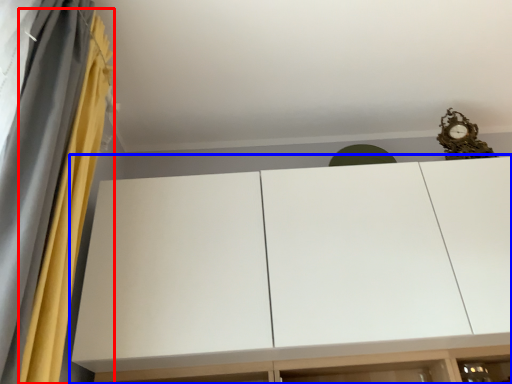
Question: Which of the following is the closest to the observer, curtain (highlighted by a red box) or cupboard (highlighted by a blue box)?

Choices:
 (A) curtain
 (B) cupboard

Answer: (A)